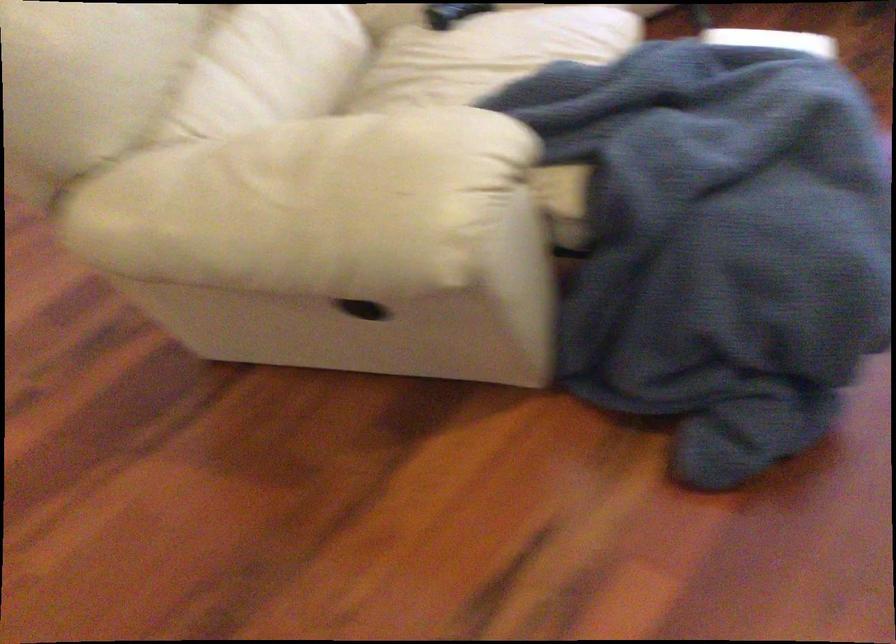
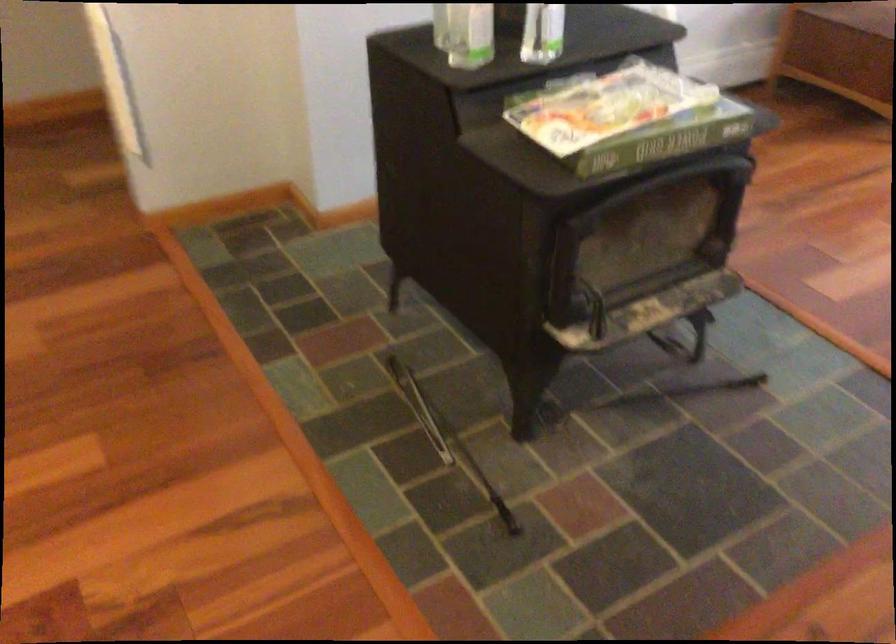
Question: The images are taken continuously from a first-person perspective. In which direction are you moving?

Choices:
 (A) Left
 (B) Right
 (C) Forward
 (D) Backward

Answer: (A)